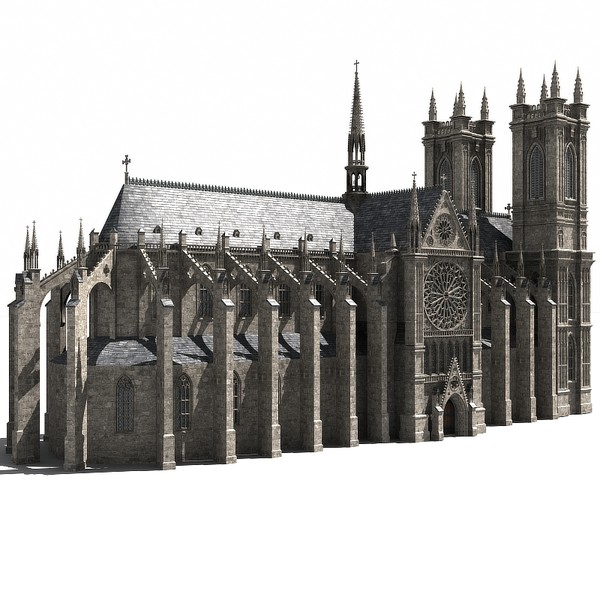
Locate an element on the screen. triangular archway is located at coordinates (460, 393).